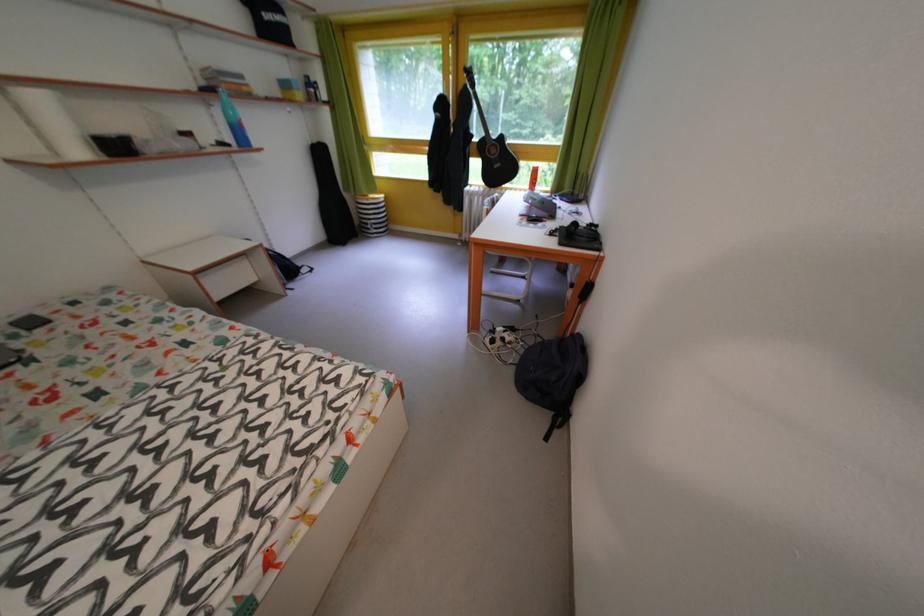
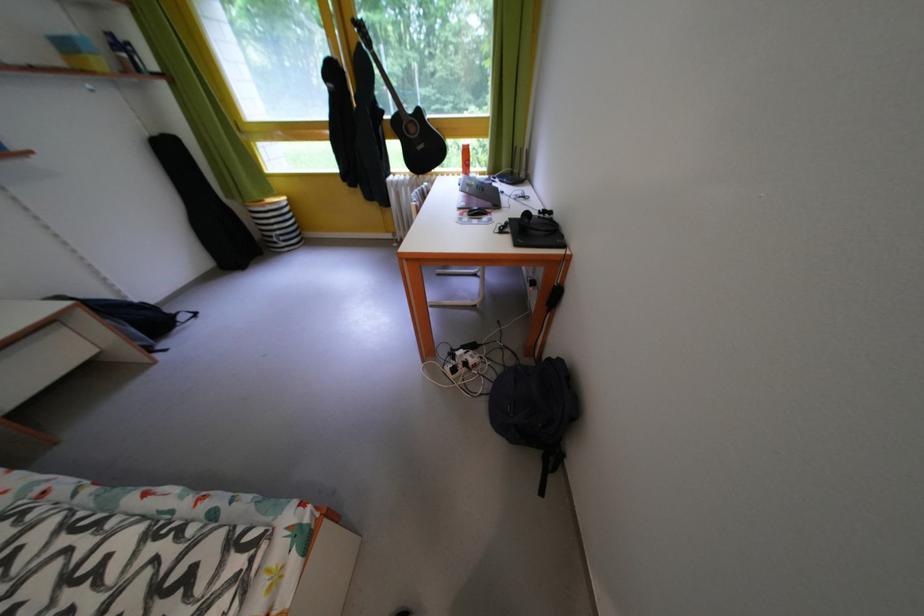
Question: How did the camera likely rotate?

Choices:
 (A) Left
 (B) Right
 (C) Up
 (D) Down

Answer: (B)